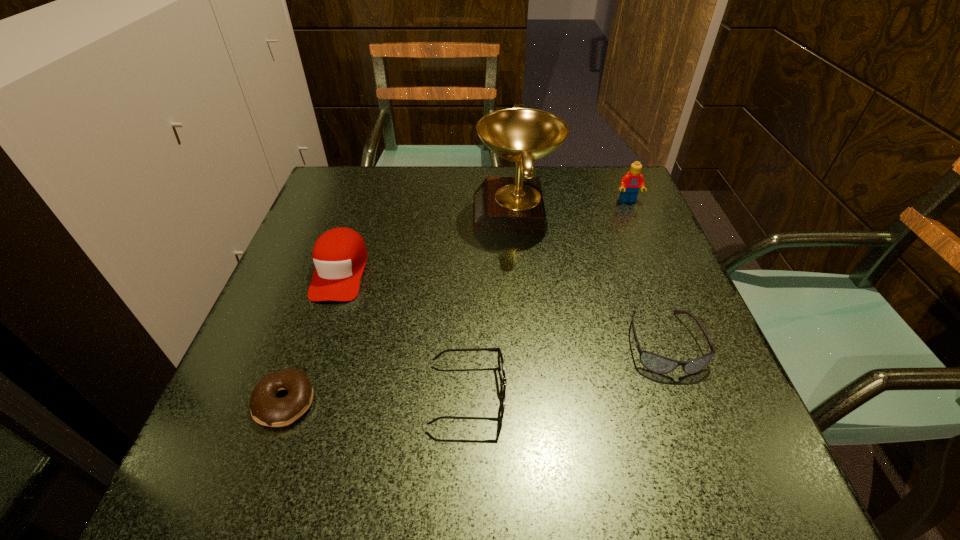
You are a GUI agent. You are given a task and a screenshot of the screen. Output one action in this format:
    pyautogui.click(x=<x>, y=<y>)
    Task: Click on the tallest object
    This screenshot has height=540, width=960.
    Given the screenshot: What is the action you would take?
    pyautogui.click(x=501, y=205)

In order to click on Lego in this screenshot , I will do `click(630, 184)`.

Locate an element on the screen. This screenshot has width=960, height=540. baseball cap is located at coordinates (339, 255).

Locate an element on the screen. This screenshot has height=540, width=960. sunglasses is located at coordinates (658, 364).

Locate an element on the screen. The height and width of the screenshot is (540, 960). spectacles is located at coordinates (503, 380).

Locate an element on the screen. The image size is (960, 540). the shortest object is located at coordinates (266, 409).

At what (x,y) coordinates should I click in order to perform the action: click on vacant space located 0.070m on the front-facing side of the award. Please return your answer as a coordinate pair (x, y). Looking at the image, I should click on (444, 214).

Locate an element on the screen. Image resolution: width=960 pixels, height=540 pixels. vacant space situated 0.180m on the front-facing side of the award is located at coordinates (399, 214).

Locate an element on the screen. vacant space located 0.360m on the front-facing side of the award is located at coordinates (326, 214).

Where is `vacant space located on the face of the Lego`? Image resolution: width=960 pixels, height=540 pixels. vacant space located on the face of the Lego is located at coordinates (664, 286).